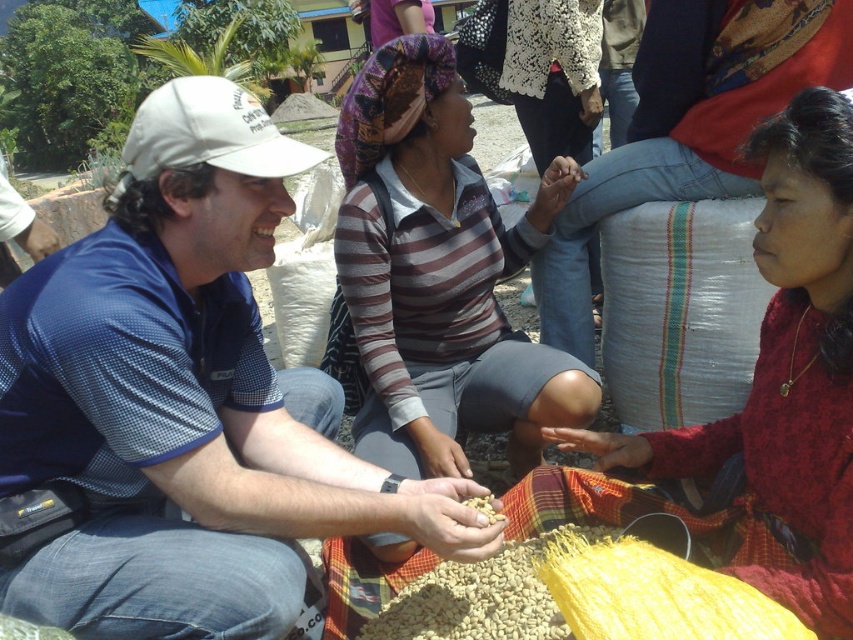
You are standing at the position of the man in the blue polo shirt and want to throw a bean to the point closer to you between point (790, 216) and point (492, 516). Which point should you aim for?

Point (790, 216) is closer to the camera than point (492, 516), so you should aim for point (790, 216).

You are a photographer trying to capture a clear shot of the striped fabric shirt at center and the brown matte beans at center. Since you want to focus on the shirt, which object should you adjust your camera lens to prioritize in terms of distance?

The striped fabric shirt at center has a greater height compared to the brown matte beans at center, so you should adjust your camera lens to prioritize focusing on the striped fabric shirt at center as it is taller and likely closer to the foreground.